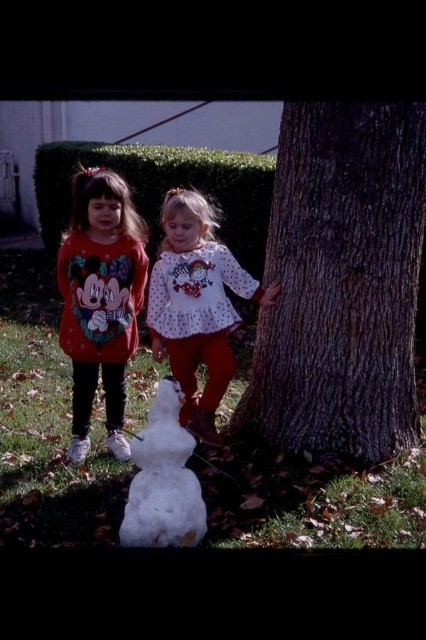
Measure the distance from dark brown textured bark at center to white fluffy snowman at center.

The distance of dark brown textured bark at center from white fluffy snowman at center is 39.11 inches.

Does dark brown textured bark at center appear under white fluffy snowman at center?

No.

I want to click on dark brown textured bark at center, so click(x=340, y=285).

Is dark brown textured bark at center to the right of white dotted shirt at center from the viewer's perspective?

Correct, you'll find dark brown textured bark at center to the right of white dotted shirt at center.

Which is above, dark brown textured bark at center or white dotted shirt at center?

dark brown textured bark at center is higher up.

Find the location of a particular element. This screenshot has height=640, width=426. dark brown textured bark at center is located at coordinates (340, 285).

Who is more distant from viewer, (131, 346) or (129, 522)?

Positioned behind is point (131, 346).

Does matte red sweatshirt at left have a lesser height compared to white fluffy snowman at center?

No.

I want to click on matte red sweatshirt at left, so click(x=100, y=300).